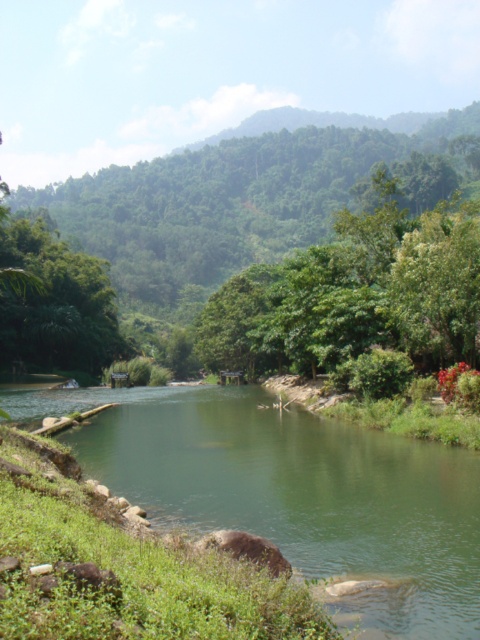
You are standing on the wooden bridge in the image and want to determine which object, the green smooth river at center or the green leafy tree at center, is closer to the sky. Based on the scene description, which one is higher?

The green leafy tree at center is higher than the green smooth river at center, so the green leafy tree at center is closer to the sky.

You are standing at the edge of the green leafy tree at center and want to cross to the other side of the green smooth river at center. Which direction should you walk to reach the river first?

You should walk to the right because the green smooth river at center is to the left of the green leafy tree at center, so moving right will lead you towards the river first.